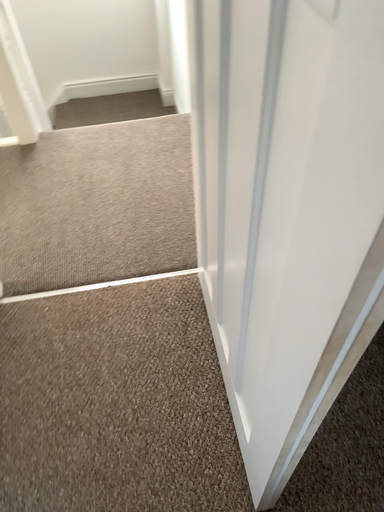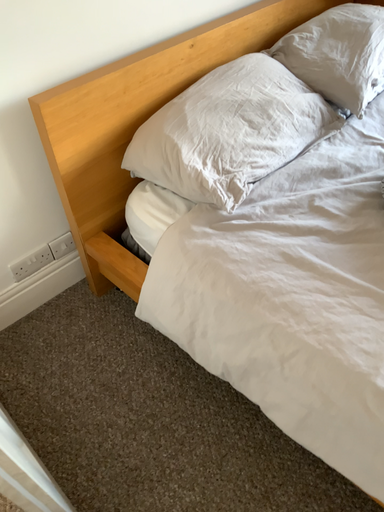
Question: Which way did the camera rotate in the video?

Choices:
 (A) rotated left
 (B) rotated right

Answer: (B)